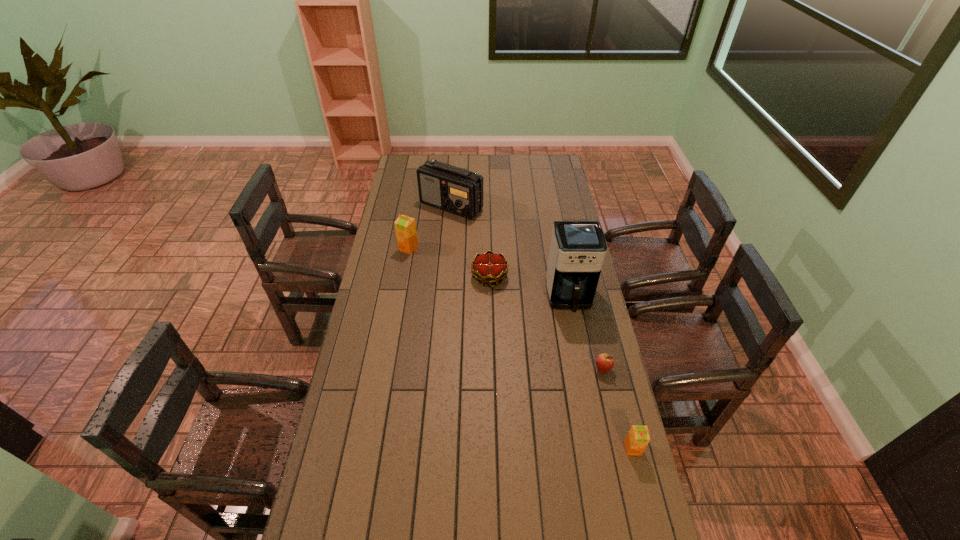
The image size is (960, 540). In order to click on vacant point located between the crown and the second farthest object in this screenshot , I will do `click(449, 262)`.

Where is `vacant area between the coffee maker and the fifth shortest object`? The height and width of the screenshot is (540, 960). vacant area between the coffee maker and the fifth shortest object is located at coordinates (511, 252).

This screenshot has width=960, height=540. What are the coordinates of `vacant region between the apple and the fourth shortest object` in the screenshot? It's located at (506, 309).

I want to click on free space that is in between the fourth shortest object and the third shortest object, so click(520, 348).

This screenshot has width=960, height=540. What are the coordinates of `vacant space that is in between the nearer orange juice and the tallest object` in the screenshot? It's located at (601, 373).

Identify which object is the nearest to the crown. Please provide its 2D coordinates. Your answer should be formatted as a tuple, i.e. [(x, y)], where the tuple contains the x and y coordinates of a point satisfying the conditions above.

[(577, 250)]

The image size is (960, 540). Find the location of `the fifth closest object to the taller orange juice`. the fifth closest object to the taller orange juice is located at coordinates (638, 437).

The width and height of the screenshot is (960, 540). I want to click on vacant point that satisfies the following two spatial constraints: 1. on the front panel of the crown; 2. on the left side of the radio receiver, so click(445, 276).

Identify the location of free space that satisfies the following two spatial constraints: 1. on the front side of the third tallest object; 2. on the left side of the right orange juice. (374, 448).

Where is `blank area in the image that satisfies the following two spatial constraints: 1. on the front side of the crown; 2. on the right side of the fifth farthest object`? Image resolution: width=960 pixels, height=540 pixels. blank area in the image that satisfies the following two spatial constraints: 1. on the front side of the crown; 2. on the right side of the fifth farthest object is located at coordinates (492, 369).